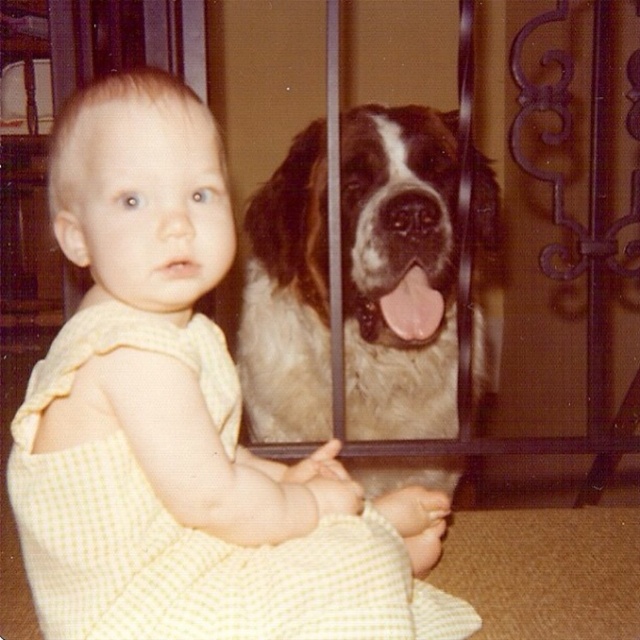
You are a photographer standing at the back of the scene. You want to take a photo of both the yellow checkered dress at center and the fuzzy white dog at center in the same frame. Can you fit both subjects into the photo without moving either of them? Explain your reasoning.

The yellow checkered dress at center and the fuzzy white dog at center are 16.12 inches apart. Since they are positioned close to each other at the center of the scene, it is possible to capture both in the same frame without needing to move them.

You are a photographer setting up a shoot in this scene. You need to position a light source to illuminate the yellow checkered dress at center without casting shadows on other objects. Where should you place the light relative to the dress?

The yellow checkered dress at center is located at point [189,528]. To avoid casting shadows on other objects, the light should be placed directly in front of the dress, ensuring it faces the dress and does not extend beyond its position.